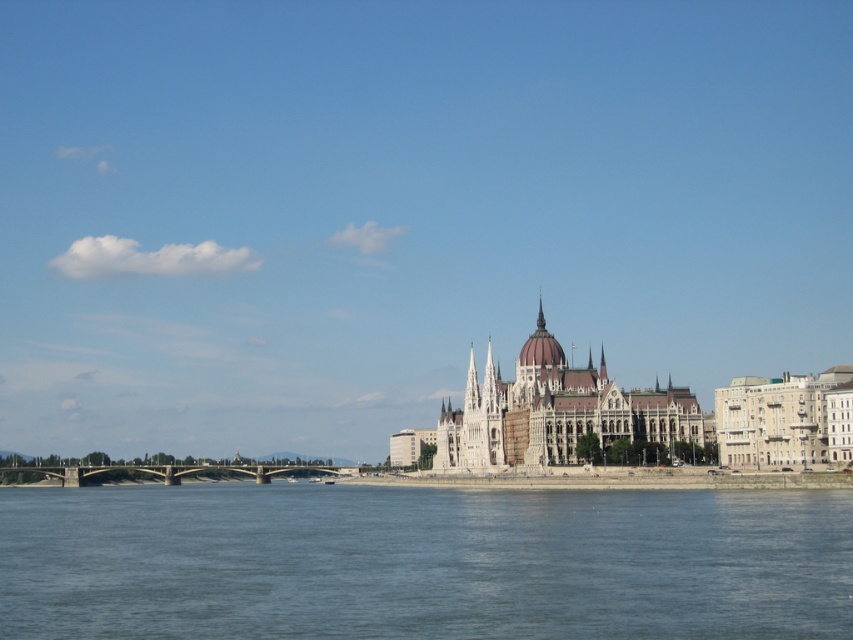
Question: Considering the relative positions of blue water at lower center and concrete bridge at lower left in the image provided, where is blue water at lower center located with respect to concrete bridge at lower left?

Choices:
 (A) right
 (B) left

Answer: (A)

Question: Among these points, which one is nearest to the camera?

Choices:
 (A) (254, 470)
 (B) (753, 490)

Answer: (B)

Question: Which point is closer to the camera?

Choices:
 (A) (436, 566)
 (B) (310, 472)

Answer: (A)

Question: Can you confirm if blue water at lower center is positioned below concrete bridge at lower left?

Choices:
 (A) yes
 (B) no

Answer: (B)

Question: Is blue water at lower center further to camera compared to concrete bridge at lower left?

Choices:
 (A) no
 (B) yes

Answer: (A)